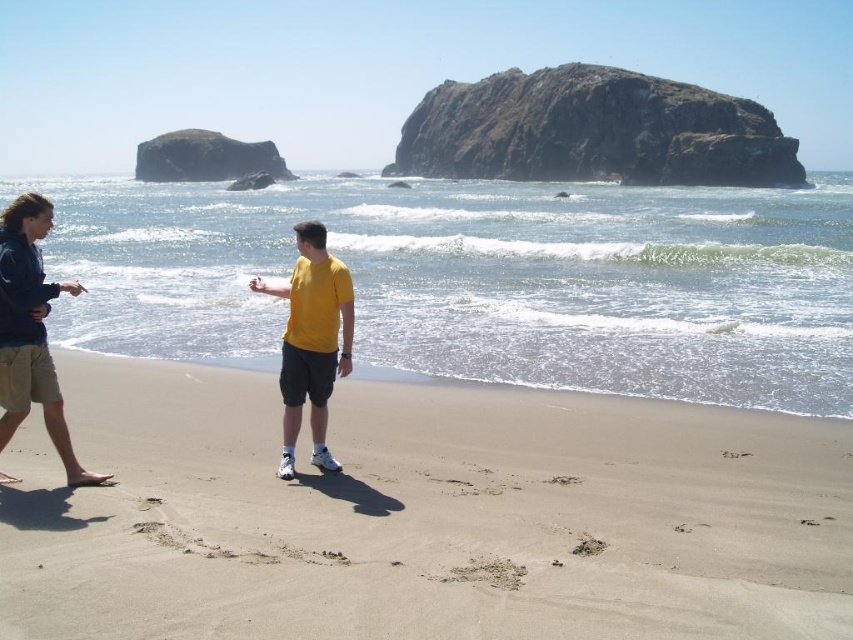
Does dark blue cotton shirt at left lie behind yellow matte shirt at center?

No, it is in front of yellow matte shirt at center.

Is point (24, 195) positioned in front of point (306, 253)?

Yes, it is in front of point (306, 253).

Who is more distant from viewer, (42,412) or (334,266)?

The point (42,412) is more distant.

At what (x,y) coordinates should I click in order to perform the action: click on dark blue cotton shirt at left. Please return your answer as a coordinate pair (x, y). Image resolution: width=853 pixels, height=640 pixels. Looking at the image, I should click on (32, 332).

Between light brown sand at center and yellow matte shirt at center, which one appears on the right side from the viewer's perspective?

Positioned to the right is light brown sand at center.

Who is positioned more to the left, light brown sand at center or yellow matte shirt at center?

yellow matte shirt at center is more to the left.

Find the location of a particular element. The width and height of the screenshot is (853, 640). light brown sand at center is located at coordinates (421, 515).

The height and width of the screenshot is (640, 853). What are the coordinates of `light brown sand at center` in the screenshot? It's located at (421, 515).

Can you confirm if light brown sand at center is wider than brown sandy footprint at lower center?

Yes.

Is point (825, 547) more distant than point (577, 552)?

Yes, point (825, 547) is farther from viewer.

The image size is (853, 640). In order to click on light brown sand at center in this screenshot , I will do `click(421, 515)`.